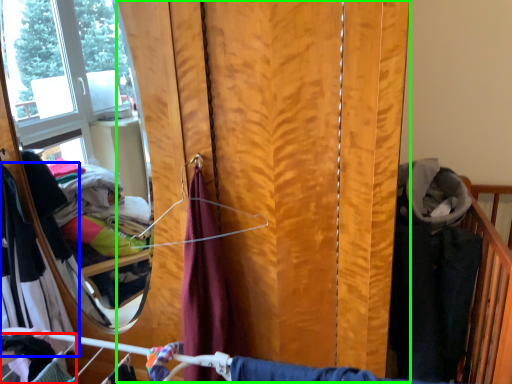
Question: Which object is positioned closest to clothing (highlighted by a red box)? Select from clothing (highlighted by a blue box) and curtain (highlighted by a green box).

Choices:
 (A) clothing
 (B) curtain

Answer: (A)